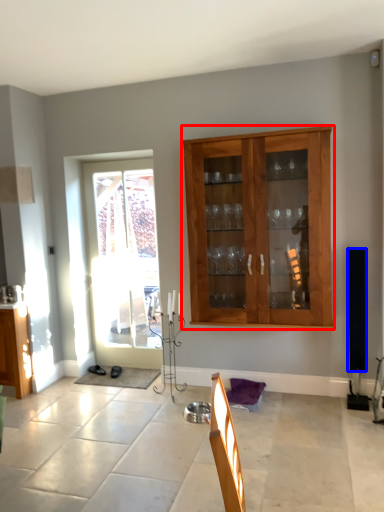
Question: Which object appears farthest to the camera in this image, cabinet (highlighted by a red box) or loudspeaker (highlighted by a blue box)?

Choices:
 (A) cabinet
 (B) loudspeaker

Answer: (B)